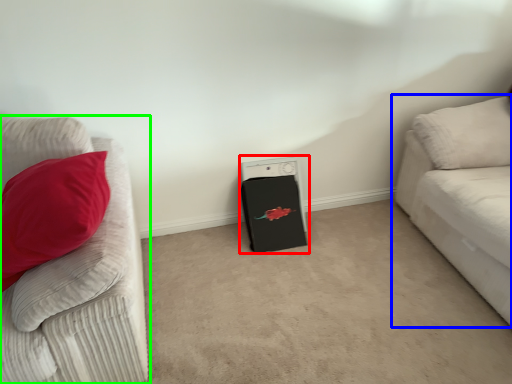
Question: Estimate the real-world distances between objects in this image. Which object is closer to appliance (highlighted by a red box), studio couch (highlighted by a blue box) or studio couch (highlighted by a green box)?

Choices:
 (A) studio couch
 (B) studio couch

Answer: (A)